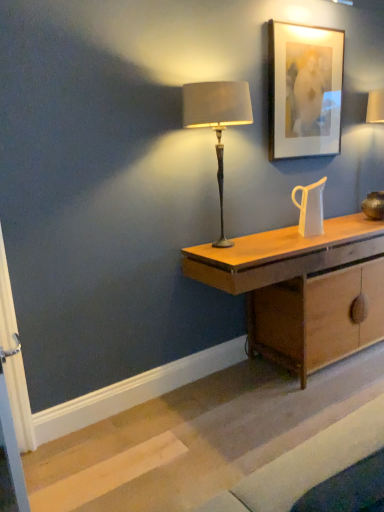
At what (x,y) coordinates should I click in order to perform the action: click on vacant space in front of transparent glass jug at center. Please return your answer as a coordinate pair (x, y). The width and height of the screenshot is (384, 512). Looking at the image, I should click on (314, 239).